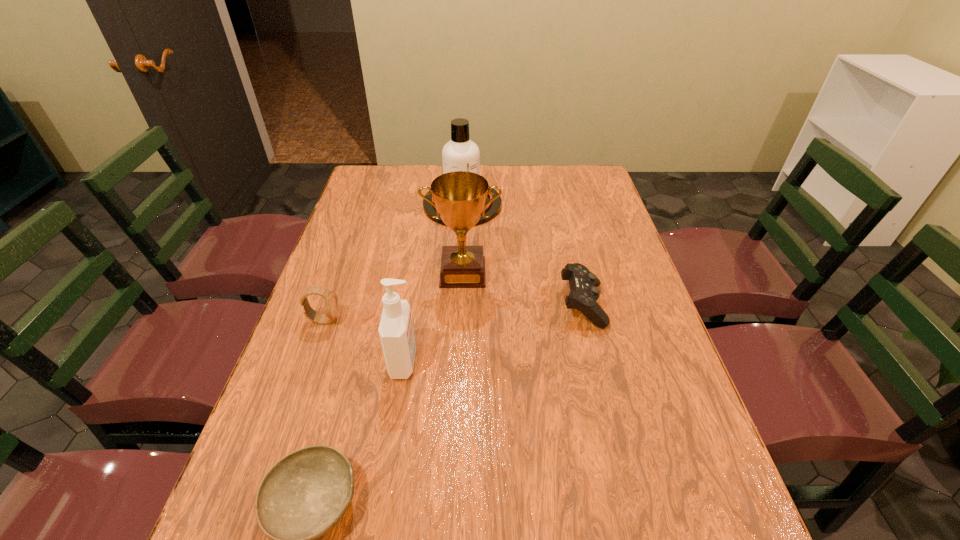
Image resolution: width=960 pixels, height=540 pixels. I want to click on the farther cleansing agent, so click(459, 154).

Image resolution: width=960 pixels, height=540 pixels. In order to click on award in this screenshot , I will do `click(459, 197)`.

What are the coordinates of `the nearer cleansing agent` in the screenshot? It's located at (396, 332).

Locate an element on the screen. This screenshot has width=960, height=540. the shorter cleansing agent is located at coordinates (396, 332).

You are a GUI agent. You are given a task and a screenshot of the screen. Output one action in this format:
    pyautogui.click(x=<x>, y=<y>)
    Task: Click on the third shortest object
    This screenshot has height=540, width=960.
    Given the screenshot: What is the action you would take?
    pyautogui.click(x=331, y=301)

Find the location of a particular element. This screenshot has height=540, width=960. the fifth tallest object is located at coordinates (584, 293).

Find the location of a particular element. the rightmost object is located at coordinates (584, 293).

Where is `vacant region located on the right of the farther cleansing agent`? Image resolution: width=960 pixels, height=540 pixels. vacant region located on the right of the farther cleansing agent is located at coordinates (547, 205).

The height and width of the screenshot is (540, 960). In order to click on blank space located 0.100m on the plaque of the award in this screenshot , I will do `click(461, 316)`.

This screenshot has height=540, width=960. I want to click on free space located 0.210m on the front label of the shorter cleansing agent, so click(x=508, y=362).